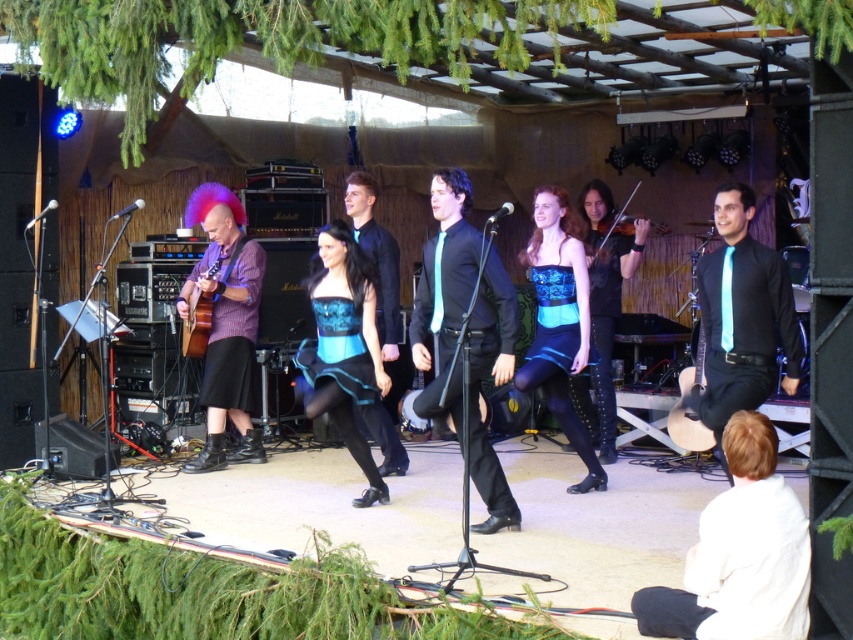
Question: Which object is closer to the camera taking this photo?

Choices:
 (A) black satin shirt at center
 (B) blue satin corset at center
 (C) light blue satin tie at center

Answer: (C)

Question: Does blue satin dress at center come behind shiny black violin at center?

Choices:
 (A) yes
 (B) no

Answer: (B)

Question: Does black leather dress at center appear on the right side of matte brown acoustic guitar at left?

Choices:
 (A) yes
 (B) no

Answer: (A)

Question: Is light blue satin tie at center thinner than black satin shirt at center?

Choices:
 (A) no
 (B) yes

Answer: (A)

Question: Which object appears farthest from the camera in this image?

Choices:
 (A) blue satin dress at center
 (B) black satin shirt at center
 (C) shiny black violin at center
 (D) matte brown acoustic guitar at left

Answer: (C)

Question: Based on their relative distances, which object is nearer to the black leather dress at center?

Choices:
 (A) blue satin dress at center
 (B) blue satin corset at center

Answer: (A)